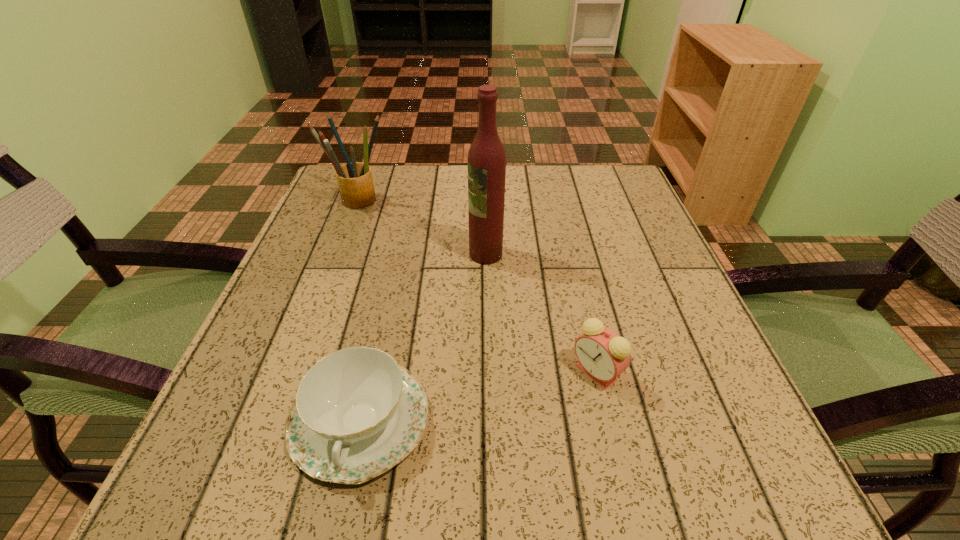
What are the coordinates of `free spot that satisfies the following two spatial constraints: 1. on the label of the tallest object; 2. on the handle side of the chinaware` in the screenshot? It's located at (489, 420).

I want to click on free space in the image that satisfies the following two spatial constraints: 1. on the label of the liquor; 2. on the handle side of the chinaware, so click(489, 420).

What are the coordinates of `vacant space that satisfies the following two spatial constraints: 1. on the label of the liquor; 2. on the handle side of the shortest object` in the screenshot? It's located at (489, 420).

Locate an element on the screen. vacant space that satisfies the following two spatial constraints: 1. on the face of the alarm clock; 2. on the handle side of the chinaware is located at coordinates (608, 420).